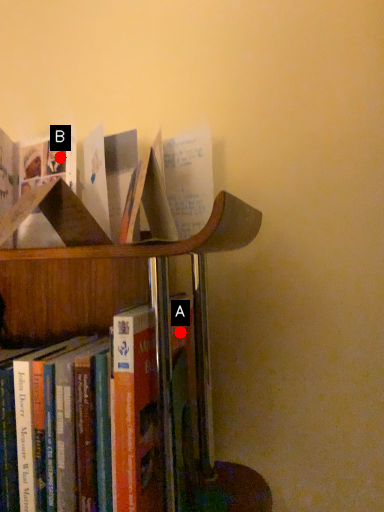
Question: Two points are circled on the image, labeled by A and B beside each circle. Which of the following is the farthest from the observer?

Choices:
 (A) A is further
 (B) B is further

Answer: (B)